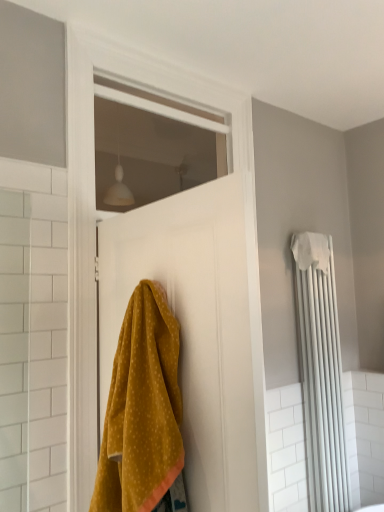
What are the coordinates of `vacant space situated above white glass window at upper center (from a real-world perspective)` in the screenshot? It's located at (165, 81).